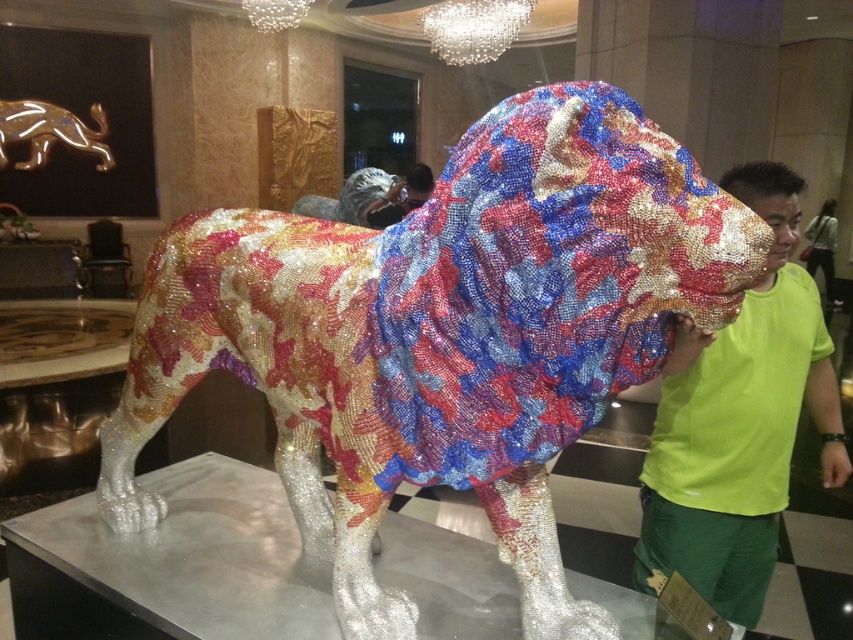
Where is `shiny metallic lion at center`? shiny metallic lion at center is located at coordinates (444, 333).

Image resolution: width=853 pixels, height=640 pixels. Identify the location of shiny metallic lion at center. (444, 333).

You are a GUI agent. You are given a task and a screenshot of the screen. Output one action in this format:
    pyautogui.click(x=<x>, y=<y>)
    Task: Click on the shiny metallic lion at center
    The image size is (853, 640).
    Given the screenshot: What is the action you would take?
    pyautogui.click(x=444, y=333)

Does green matte shirt at right appear over gold metallic lion at upper left?

No.

Between point (660, 541) and point (51, 131), which one is positioned in front?

Point (660, 541)

The width and height of the screenshot is (853, 640). Describe the element at coordinates (740, 420) in the screenshot. I see `green matte shirt at right` at that location.

You are a GUI agent. You are given a task and a screenshot of the screen. Output one action in this format:
    pyautogui.click(x=<x>, y=<y>)
    Task: Click on the green matte shirt at right
    The image size is (853, 640).
    Given the screenshot: What is the action you would take?
    pyautogui.click(x=740, y=420)

How far apart are shiny metallic lion at center and green matte shirt at right?

A distance of 27.01 inches exists between shiny metallic lion at center and green matte shirt at right.

Does point (495, 323) come in front of point (730, 436)?

Yes, it is in front of point (730, 436).

Describe the element at coordinates (444, 333) in the screenshot. I see `shiny metallic lion at center` at that location.

Locate an element on the screen. shiny metallic lion at center is located at coordinates click(444, 333).